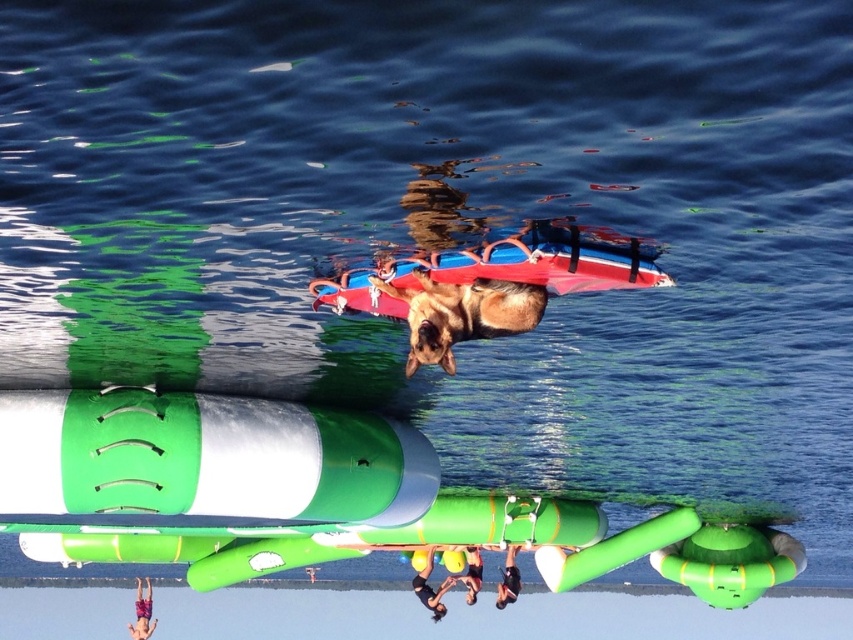
You are standing at the edge of the water park slide and see the multicolored shorts at lower left and the black matte person at lower center. Which object is positioned more to the left side of the scene?

The multicolored shorts at lower left are positioned more to the left side of the scene compared to the black matte person at lower center.

You are standing at the edge of the water park and see the multicolored shorts at lower left and the black matte person at lower center. Which object is taller?

The multicolored shorts at lower left is taller than the black matte person at lower center.